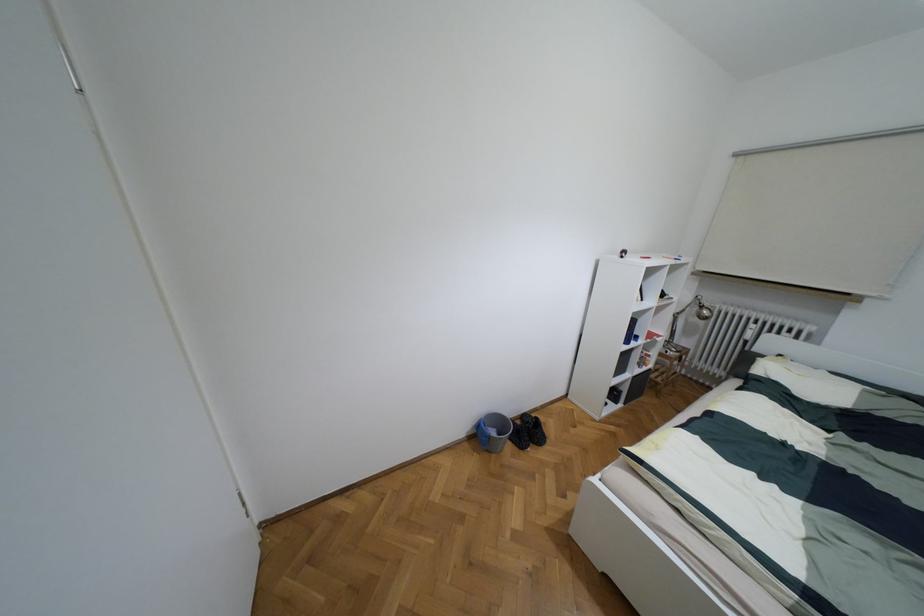
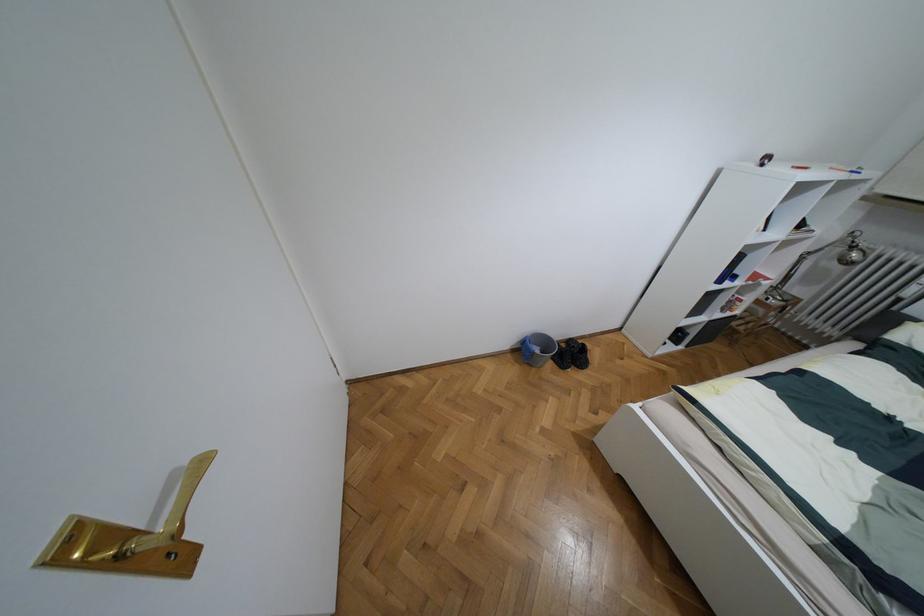
Locate, in the second image, the point that corresponds to point (492, 432) in the first image.

(536, 350)